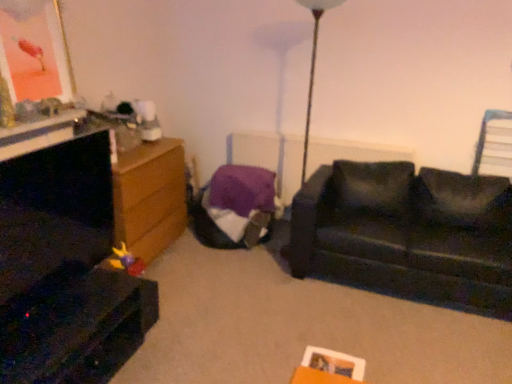
Question: Is wooden chest of drawers at left outside plush yellow and purple toy at lower left?

Choices:
 (A) no
 (B) yes

Answer: (B)

Question: From the image's perspective, would you say wooden chest of drawers at left is positioned over plush yellow and purple toy at lower left?

Choices:
 (A) yes
 (B) no

Answer: (A)

Question: Considering the relative sizes of wooden chest of drawers at left and plush yellow and purple toy at lower left in the image provided, is wooden chest of drawers at left taller than plush yellow and purple toy at lower left?

Choices:
 (A) no
 (B) yes

Answer: (B)

Question: Considering the relative sizes of wooden chest of drawers at left and plush yellow and purple toy at lower left in the image provided, is wooden chest of drawers at left smaller than plush yellow and purple toy at lower left?

Choices:
 (A) no
 (B) yes

Answer: (A)

Question: From a real-world perspective, is wooden chest of drawers at left located beneath plush yellow and purple toy at lower left?

Choices:
 (A) yes
 (B) no

Answer: (B)

Question: Could you tell me if wooden chest of drawers at left is turned towards plush yellow and purple toy at lower left?

Choices:
 (A) yes
 (B) no

Answer: (B)

Question: From the image's perspective, is plush yellow and purple toy at lower left under purple fabric bean bag at center?

Choices:
 (A) no
 (B) yes

Answer: (B)

Question: From the image's perspective, does plush yellow and purple toy at lower left appear higher than purple fabric bean bag at center?

Choices:
 (A) yes
 (B) no

Answer: (B)

Question: Can you confirm if plush yellow and purple toy at lower left is positioned to the right of purple fabric bean bag at center?

Choices:
 (A) no
 (B) yes

Answer: (A)

Question: Is plush yellow and purple toy at lower left positioned before purple fabric bean bag at center?

Choices:
 (A) yes
 (B) no

Answer: (A)

Question: Is plush yellow and purple toy at lower left thinner than purple fabric bean bag at center?

Choices:
 (A) yes
 (B) no

Answer: (A)

Question: Is the position of plush yellow and purple toy at lower left more distant than that of purple fabric bean bag at center?

Choices:
 (A) yes
 (B) no

Answer: (B)

Question: Considering the relative sizes of purple fabric radiator at center and metallic gold picture frame at upper left in the image provided, is purple fabric radiator at center wider than metallic gold picture frame at upper left?

Choices:
 (A) yes
 (B) no

Answer: (B)